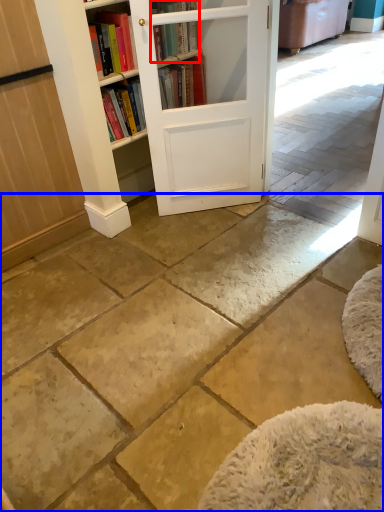
Question: Which object appears farthest to the camera in this image, book (highlighted by a red box) or concrete (highlighted by a blue box)?

Choices:
 (A) book
 (B) concrete

Answer: (A)